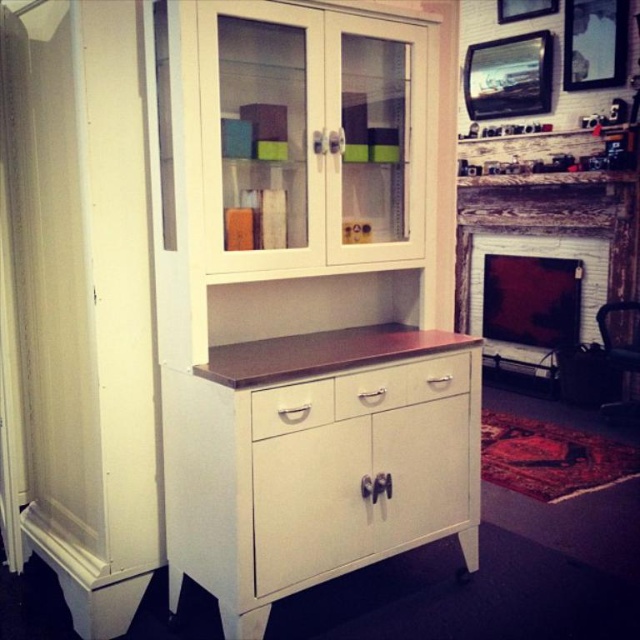
You are planning to move a large painting that is 1.8 meters wide. You need to decide whether to place it above the white wood dresser at center or above the white brick fireplace at center. Based on the width of these objects, which location would be more suitable for the painting?

The white wood dresser at center might be wider than white brick fireplace at center, so placing the painting above the white wood dresser at center would be more suitable as it likely has enough width to accommodate the 1.8 meters wide painting.

You are organizing a small party and need to place a 1.2 meter long cake on the white wood dresser at center and the white matte drawer at center. Which surface can accommodate the cake without it overhanging?

The white wood dresser at center has a greater width than the white matte drawer at center, so the cake can be placed on the white wood dresser at center without overhanging.

You are moving a 30 cm wide decorative vase and want to place it between the white wood dresser at center and the satin white drawer at center. Is there enough space for the vase?

The distance between the white wood dresser at center and the satin white drawer at center is 36.43 centimeters. Since the vase is only 30 centimeters wide, there is enough space to place it between them.